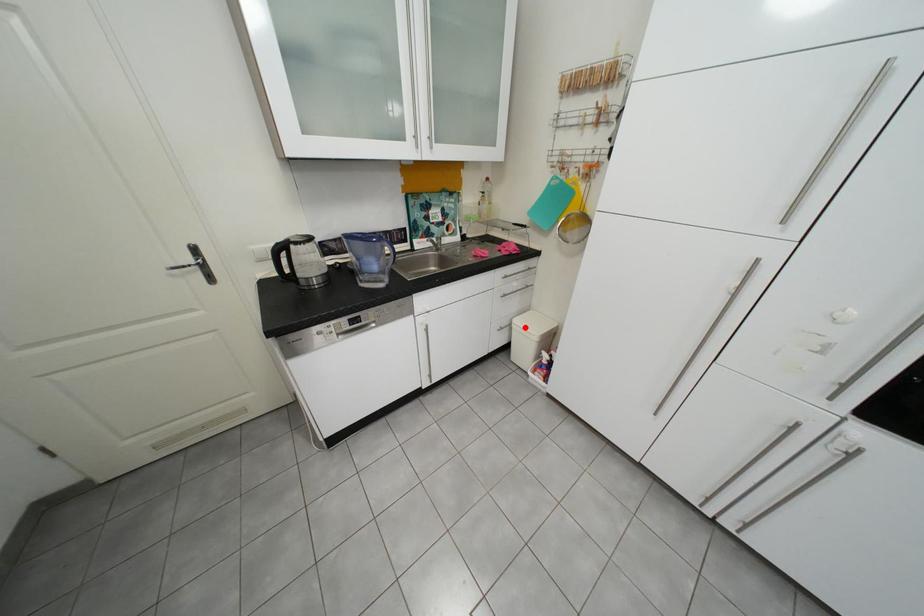
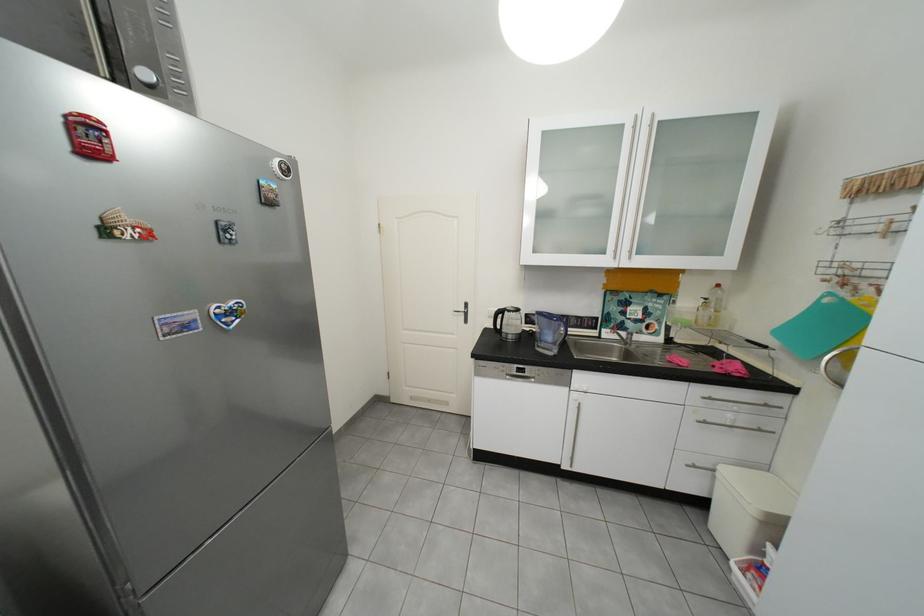
Find the pixel in the second image that matches the highlighted location in the first image.

(730, 476)